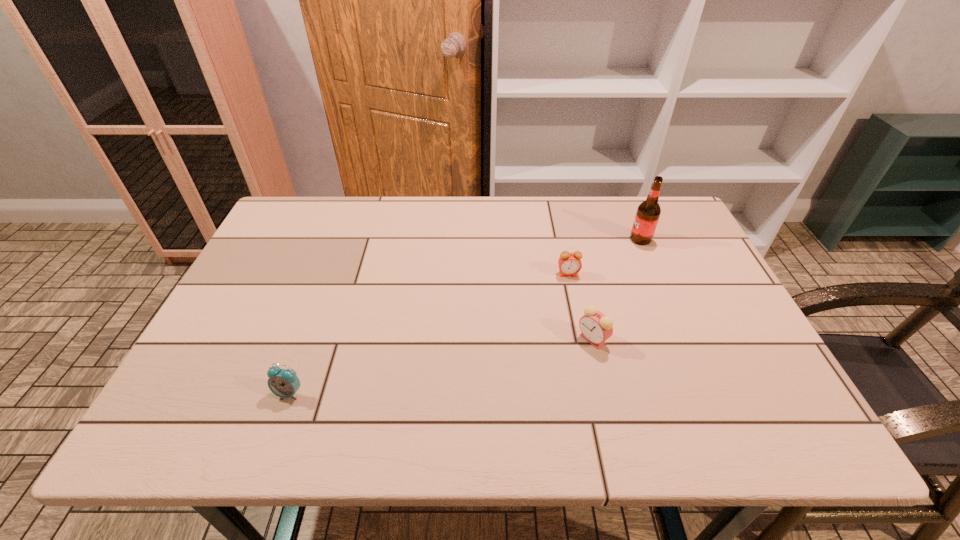
Image resolution: width=960 pixels, height=540 pixels. Find the location of `root beer`. root beer is located at coordinates (648, 212).

The width and height of the screenshot is (960, 540). In order to click on the tallest object in this screenshot , I will do `click(648, 212)`.

The height and width of the screenshot is (540, 960). In order to click on the second nearest alarm clock in this screenshot , I will do `click(596, 328)`.

The image size is (960, 540). In order to click on the second farthest object in this screenshot , I will do `click(569, 263)`.

Locate an element on the screen. the nearest object is located at coordinates (284, 383).

Where is `the nearest alarm clock`? This screenshot has width=960, height=540. the nearest alarm clock is located at coordinates (284, 383).

I want to click on free spot located 0.150m on the left of the farthest object, so click(580, 239).

I want to click on vacant space located 0.270m on the face of the third farthest object, so click(464, 339).

Locate an element on the screen. vacant space located on the face of the third farthest object is located at coordinates (506, 339).

Locate an element on the screen. Image resolution: width=960 pixels, height=540 pixels. vacant area located 0.150m on the face of the third farthest object is located at coordinates (515, 339).